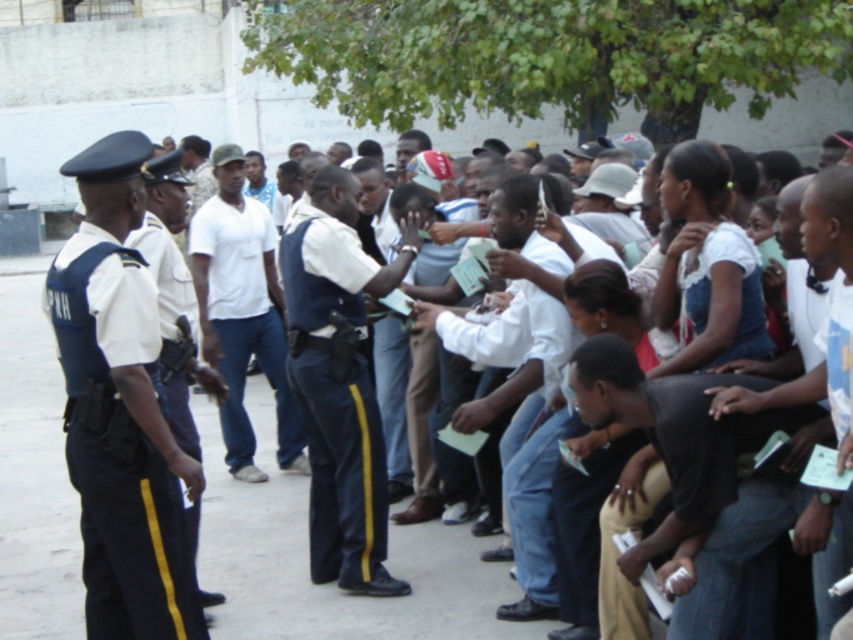
Question: Based on their relative distances, which object is farther from the dark blue fabric uniform at left?

Choices:
 (A) white matte shirt at center
 (B) white cotton shirt at center
 (C) dark blue uniform at center

Answer: (B)

Question: Among these objects, which one is nearest to the camera?

Choices:
 (A) dark blue fabric uniform at left
 (B) white matte shirt at center

Answer: (A)

Question: Which of the following is the closest to the observer?

Choices:
 (A) white matte shirt at center
 (B) white cotton shirt at center

Answer: (A)

Question: Is dark blue fabric uniform at left above dark blue uniform at center?

Choices:
 (A) no
 (B) yes

Answer: (B)

Question: Is navy blue fabric pants at center behind white matte shirt at center?

Choices:
 (A) yes
 (B) no

Answer: (B)

Question: Can you confirm if dark blue fabric uniform at left is positioned to the right of white cotton shirt at center?

Choices:
 (A) yes
 (B) no

Answer: (B)